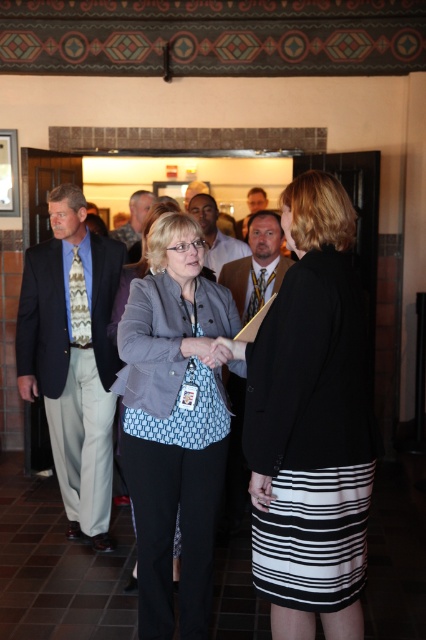
You are attending a professional event and notice two attendees wearing blue clothing at the center of the scene. Which one is positioned lower between the blue printed blouse at center and the matte blue shirt at center?

The blue printed blouse at center is located below the matte blue shirt at center, so the blue printed blouse at center is positioned lower.

You are attending a professional event and notice two attendees wearing similar attire. The first person is wearing a matte gray blazer at center, and the second is wearing a matte gray suit at center. From your perspective, which clothing item is closer to you?

The matte gray blazer at center is closer to you because it is positioned in front of the matte gray suit at center.